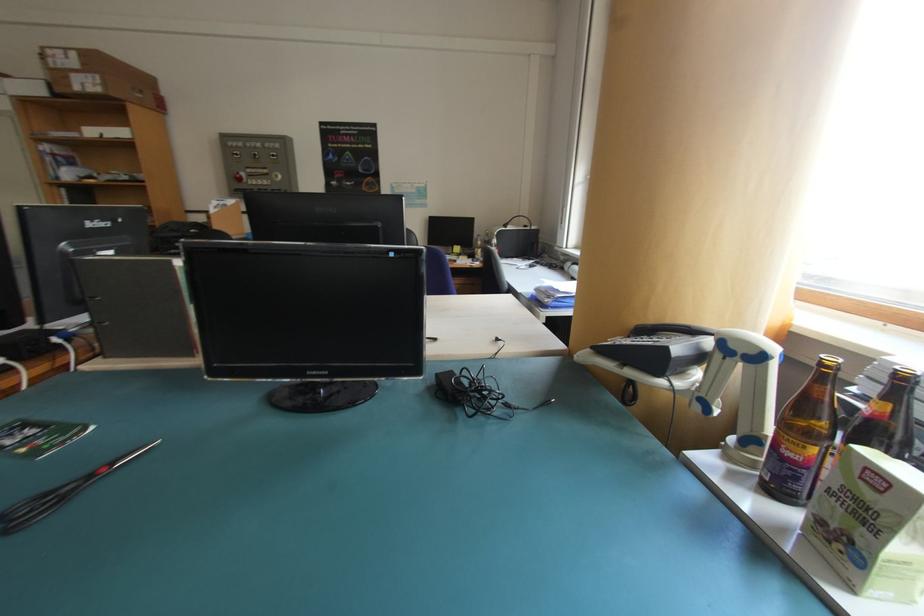
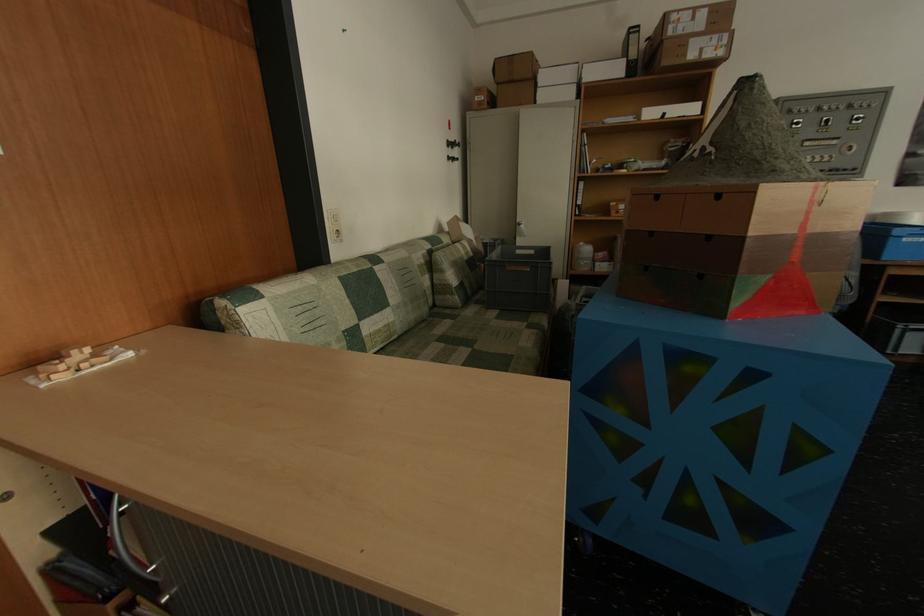
Question: In a continuous first-person perspective shot, in which direction is the camera moving?

Choices:
 (A) Left
 (B) Right
 (C) Forward
 (D) Backward

Answer: (A)